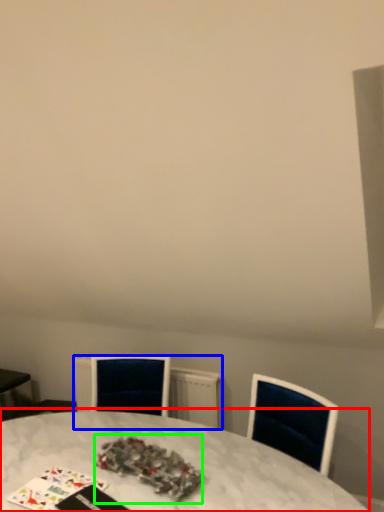
Question: Which object is positioned closest to table (highlighted by a red box)? Select from radiator (highlighted by a blue box) and christmas decoration (highlighted by a green box).

Choices:
 (A) radiator
 (B) christmas decoration

Answer: (B)